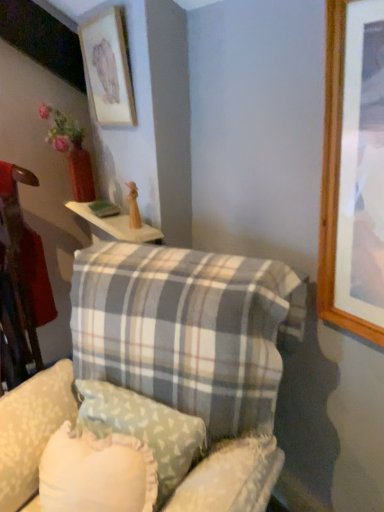
Question: Which is correct: plaid fabric pillow at center, the first pillow positioned from the front, is inside matte wooden picture frame at upper left, or outside of it?

Choices:
 (A) outside
 (B) inside

Answer: (A)

Question: From a real-world perspective, is plaid fabric pillow at center, positioned as the 2th pillow in back-to-front order, positioned above or below matte wooden picture frame at upper left?

Choices:
 (A) below
 (B) above

Answer: (A)

Question: Estimate the real-world distances between objects in this image. Which object is farther from the matte wooden picture frame at upper left?

Choices:
 (A) white wood table at upper center
 (B) plaid fabric swivel chair at lower center
 (C) plaid fabric pillow at center, the first pillow positioned from the front
 (D) light blue fabric pillow at center, which is counted as the first pillow, starting from the back

Answer: (D)

Question: Which object is positioned farthest from the matte wooden picture frame at upper left?

Choices:
 (A) plaid fabric swivel chair at lower center
 (B) light blue fabric pillow at center, which is counted as the first pillow, starting from the back
 (C) white wood table at upper center
 (D) plaid fabric pillow at center, positioned as the 2th pillow in back-to-front order

Answer: (B)